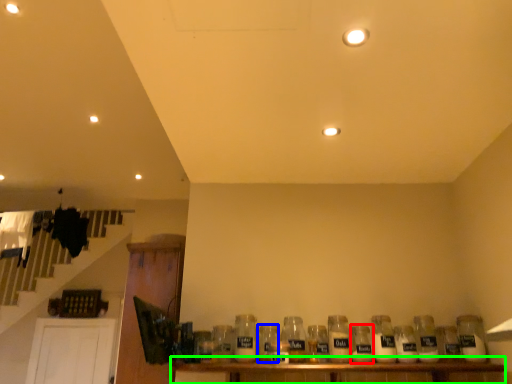
Question: Which object is the farthest from bottle (highlighted by a red box)? Choose among these: bottle (highlighted by a blue box) or table (highlighted by a green box).

Choices:
 (A) bottle
 (B) table

Answer: (A)